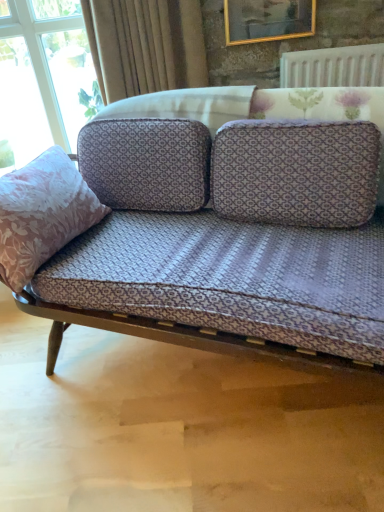
What do you see at coordinates (333, 67) in the screenshot?
I see `white textured radiator at upper right` at bounding box center [333, 67].

Find the location of a particular element. The image size is (384, 512). gold-framed picture at upper center is located at coordinates click(x=268, y=20).

The image size is (384, 512). Describe the element at coordinates (210, 286) in the screenshot. I see `lavender fabric couch at center` at that location.

Where is `white textured radiator at upper right`? white textured radiator at upper right is located at coordinates (333, 67).

What are the coordinates of `radiator that is below the velvet beige curtain at upper center (from the image's perspective)` in the screenshot? It's located at (333, 67).

Is velvet beige curtain at upper center bigger than white textured radiator at upper right?

Correct, velvet beige curtain at upper center is larger in size than white textured radiator at upper right.

How far apart are velvet beige curtain at upper center and white textured radiator at upper right?

The distance of velvet beige curtain at upper center from white textured radiator at upper right is 59.88 centimeters.

Is velvet beige curtain at upper center wider than white textured radiator at upper right?

Correct, the width of velvet beige curtain at upper center exceeds that of white textured radiator at upper right.

Does lavender fabric couch at center have a greater width compared to pink floral fabric pillow at left?

Yes, lavender fabric couch at center is wider than pink floral fabric pillow at left.

Locate an element on the screen. throw pillow that is above the lavender fabric couch at center (from the image's perspective) is located at coordinates (42, 214).

Is lavender fabric couch at center facing away from pink floral fabric pillow at left?

No.

Who is taller, lavender fabric couch at center or pink floral fabric pillow at left?

Standing taller between the two is lavender fabric couch at center.

Can we say pink floral fabric pillow at left lies outside lavender fabric couch at center?

Actually, pink floral fabric pillow at left is at least partially inside lavender fabric couch at center.

From a real-world perspective, which object rests below the other?

lavender fabric couch at center is physically lower.

Can you confirm if pink floral fabric pillow at left is positioned to the left of lavender fabric couch at center?

Yes, pink floral fabric pillow at left is to the left of lavender fabric couch at center.

Does lavender fabric couch at center have a lesser width compared to white textured radiator at upper right?

Incorrect, the width of lavender fabric couch at center is not less than that of white textured radiator at upper right.

From a real-world perspective, which object stands above the other?

In real-world perspective, white textured radiator at upper right is above.

Considering the relative sizes of lavender fabric couch at center and white textured radiator at upper right in the image provided, is lavender fabric couch at center shorter than white textured radiator at upper right?

Incorrect, the height of lavender fabric couch at center does not fall short of that of white textured radiator at upper right.

From the image's perspective, which one is positioned higher, lavender fabric couch at center or white textured radiator at upper right?

white textured radiator at upper right, from the image's perspective.

Is gold-framed picture at upper center not close to velvet beige curtain at upper center?

No, gold-framed picture at upper center is not far away from velvet beige curtain at upper center.

Find the location of a particular element. curtain beneath the gold-framed picture at upper center (from a real-world perspective) is located at coordinates (145, 45).

Which object is thinner, gold-framed picture at upper center or velvet beige curtain at upper center?

gold-framed picture at upper center.

Is velvet beige curtain at upper center positioned with its back to gold-framed picture at upper center?

No, velvet beige curtain at upper center's orientation is not away from gold-framed picture at upper center.

Measure the distance between velvet beige curtain at upper center and gold-framed picture at upper center.

A distance of 14.01 inches exists between velvet beige curtain at upper center and gold-framed picture at upper center.

From a real-world perspective, which object stands above the other?

gold-framed picture at upper center is physically above.

Does point (179, 83) lie in front of point (245, 32)?

That is False.

Consider the image. Does white textured radiator at upper right come in front of pink floral fabric pillow at left?

No, the depth of white textured radiator at upper right is greater than that of pink floral fabric pillow at left.

Is white textured radiator at upper right wider or thinner than pink floral fabric pillow at left?

In the image, white textured radiator at upper right appears to be more narrow than pink floral fabric pillow at left.

Measure the distance between white textured radiator at upper right and pink floral fabric pillow at left.

white textured radiator at upper right is 1.18 meters from pink floral fabric pillow at left.

Is white textured radiator at upper right bigger than pink floral fabric pillow at left?

No.

Where is `curtain that is above the white textured radiator at upper right (from a real-world perspective)`? The width and height of the screenshot is (384, 512). curtain that is above the white textured radiator at upper right (from a real-world perspective) is located at coordinates (145, 45).

Image resolution: width=384 pixels, height=512 pixels. I want to click on studio couch that is below the pink floral fabric pillow at left (from the image's perspective), so click(210, 286).

Based on their spatial positions, is pink floral fabric pillow at left or lavender fabric couch at center closer to gold-framed picture at upper center?

lavender fabric couch at center is positioned closer to the anchor gold-framed picture at upper center.

Looking at the image, which one is located further to lavender fabric couch at center, gold-framed picture at upper center or white textured radiator at upper right?

gold-framed picture at upper center is further to lavender fabric couch at center.

Based on their spatial positions, is gold-framed picture at upper center or velvet beige curtain at upper center closer to white textured radiator at upper right?

gold-framed picture at upper center lies closer to white textured radiator at upper right than the other object.

Considering their positions, is gold-framed picture at upper center positioned closer to velvet beige curtain at upper center than lavender fabric couch at center?

Based on the image, gold-framed picture at upper center appears to be nearer to velvet beige curtain at upper center.

Considering their positions, is gold-framed picture at upper center positioned closer to velvet beige curtain at upper center than pink floral fabric pillow at left?

gold-framed picture at upper center.

From the image, which object appears to be farther from lavender fabric couch at center, pink floral fabric pillow at left or white textured radiator at upper right?

white textured radiator at upper right is further to lavender fabric couch at center.

When comparing their distances from velvet beige curtain at upper center, does lavender fabric couch at center or pink floral fabric pillow at left seem closer?

lavender fabric couch at center is positioned closer to the anchor velvet beige curtain at upper center.

Which object lies further to the anchor point pink floral fabric pillow at left, gold-framed picture at upper center or velvet beige curtain at upper center?

The object further to pink floral fabric pillow at left is gold-framed picture at upper center.

At what (x,y) coordinates should I click in order to perform the action: click on curtain positioned between lavender fabric couch at center and white textured radiator at upper right from near to far. Please return your answer as a coordinate pair (x, y). Looking at the image, I should click on (145, 45).

The height and width of the screenshot is (512, 384). I want to click on picture frame located between lavender fabric couch at center and white textured radiator at upper right in the depth direction, so click(268, 20).

Image resolution: width=384 pixels, height=512 pixels. What are the coordinates of `throw pillow between gold-framed picture at upper center and lavender fabric couch at center vertically` in the screenshot? It's located at (42, 214).

Where is `picture frame between pink floral fabric pillow at left and white textured radiator at upper right in the horizontal direction`? picture frame between pink floral fabric pillow at left and white textured radiator at upper right in the horizontal direction is located at coordinates (268, 20).